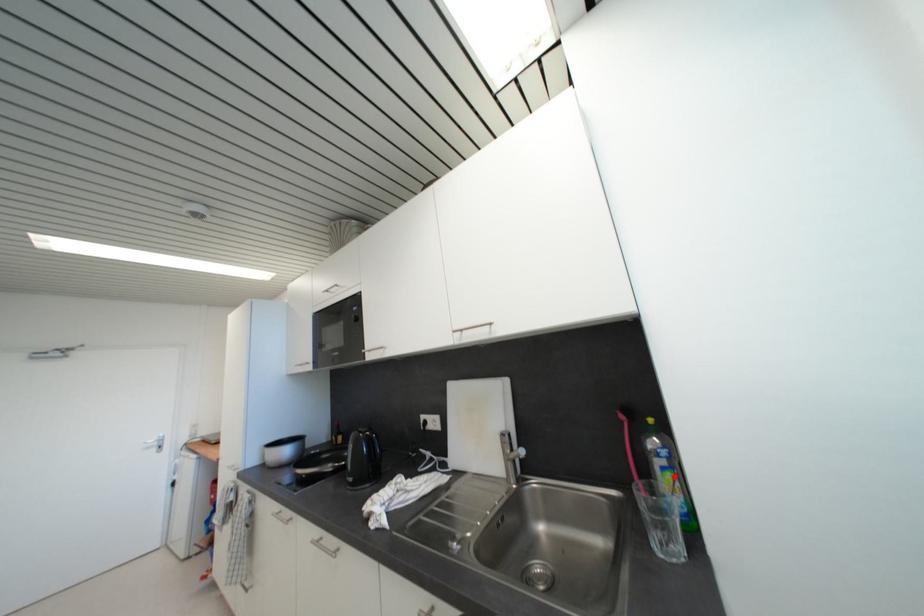
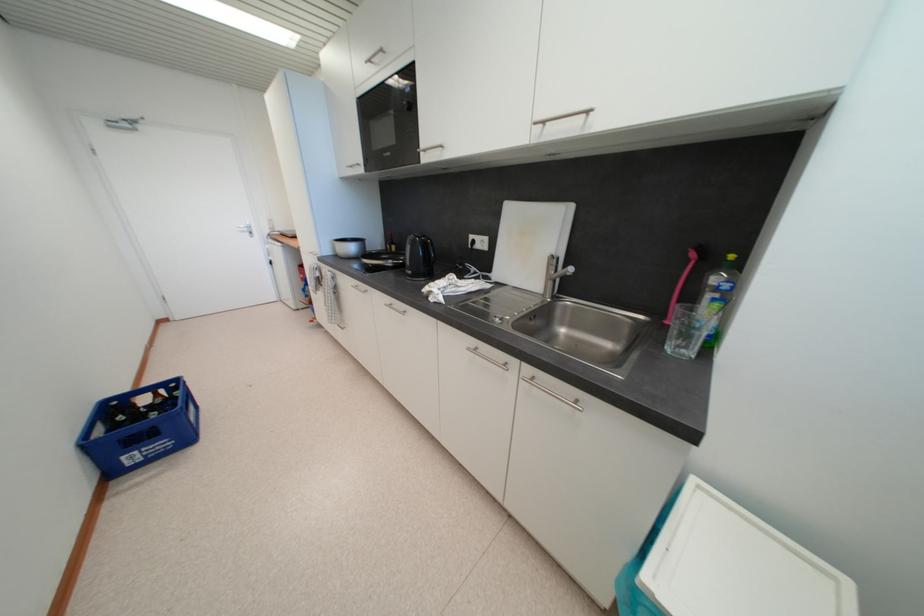
Find the pixel in the second image that matches the highlighted location in the first image.

(723, 307)